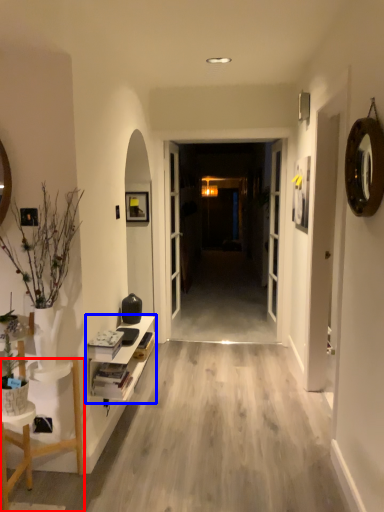
Question: Which of the following is the closest to the observer, furniture (highlighted by a red box) or shelf (highlighted by a blue box)?

Choices:
 (A) furniture
 (B) shelf

Answer: (A)